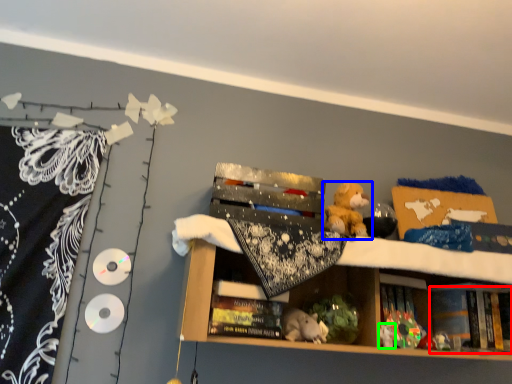
Question: Based on their relative distances, which object is nearer to book (highlighted by a red box)? Choose from toy (highlighted by a blue box) and toy (highlighted by a green box).

Choices:
 (A) toy
 (B) toy

Answer: (B)